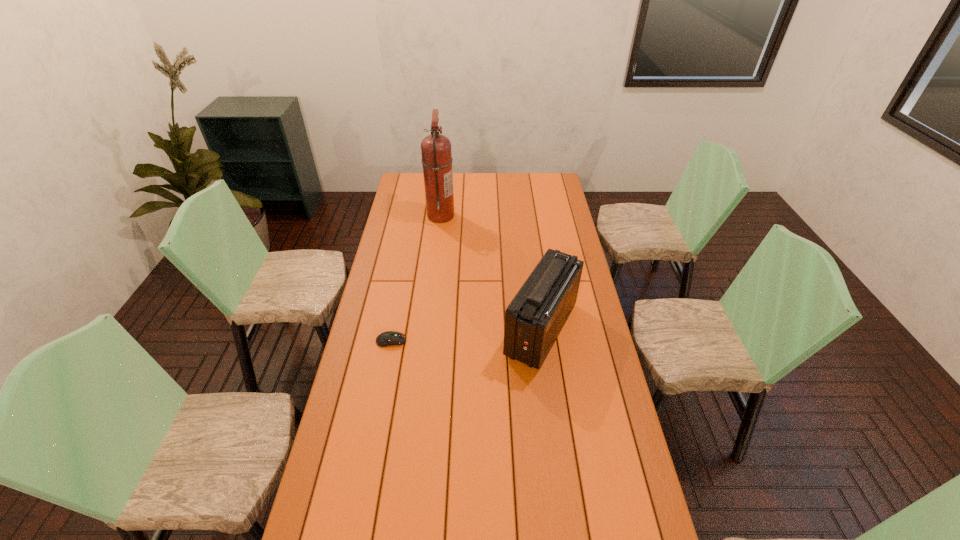
Identify the location of the second object from left to right. The height and width of the screenshot is (540, 960). (436, 151).

This screenshot has height=540, width=960. I want to click on the farthest object, so click(x=436, y=151).

Identify the location of the rightmost object. (533, 320).

Identify the location of the second shortest object. (533, 320).

This screenshot has height=540, width=960. I want to click on the leftmost object, so click(389, 338).

I want to click on the shortest object, so click(389, 338).

This screenshot has width=960, height=540. Find the location of `free space located 0.180m on the front-facing side of the fire extinguisher`. free space located 0.180m on the front-facing side of the fire extinguisher is located at coordinates pyautogui.click(x=490, y=215).

You are a GUI agent. You are given a task and a screenshot of the screen. Output one action in this format:
    pyautogui.click(x=<x>, y=<y>)
    Task: Click on the blank space located on the front panel of the second shortest object
    This screenshot has height=540, width=960.
    Given the screenshot: What is the action you would take?
    pyautogui.click(x=463, y=329)

Find the location of a particular element. The width and height of the screenshot is (960, 540). vacant area located on the front panel of the second shortest object is located at coordinates (397, 329).

Locate an element on the screen. blank area located on the front panel of the second shortest object is located at coordinates (481, 329).